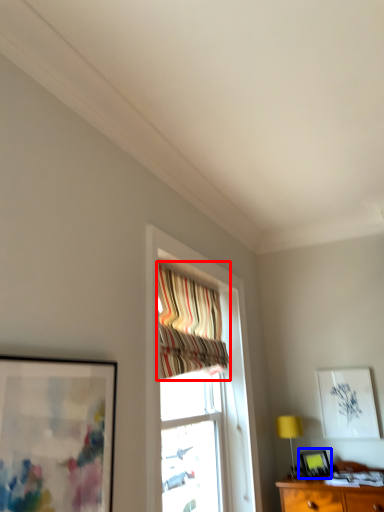
Question: Which object is closer to the camera taking this photo, curtain (highlighted by a red box) or picture frame (highlighted by a blue box)?

Choices:
 (A) curtain
 (B) picture frame

Answer: (A)